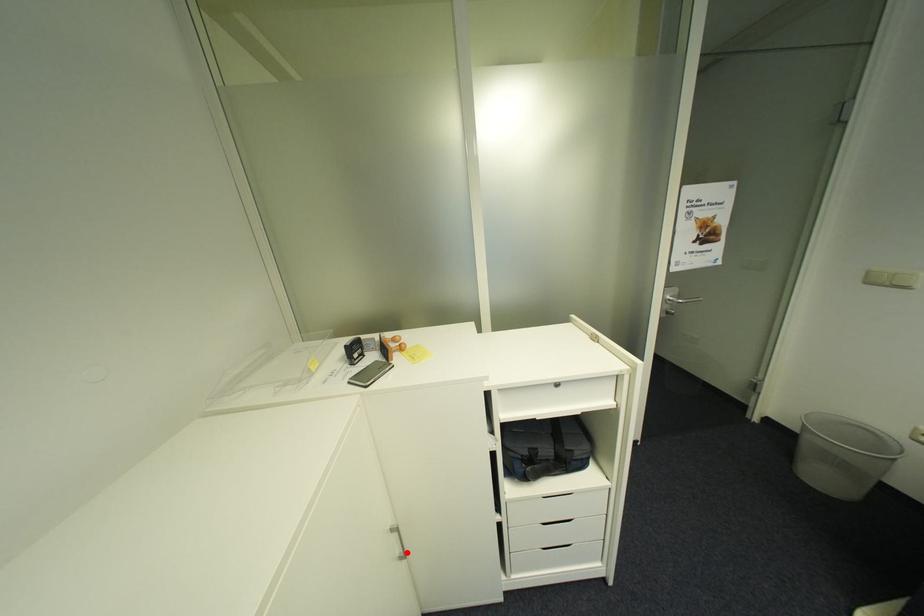
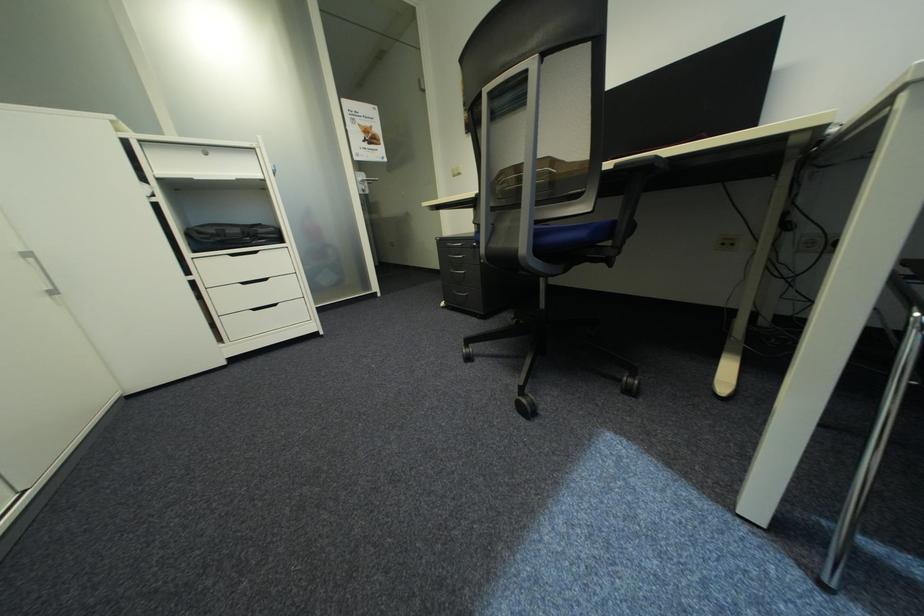
Find the pixel in the second image that matches the highlighted location in the first image.

(55, 288)